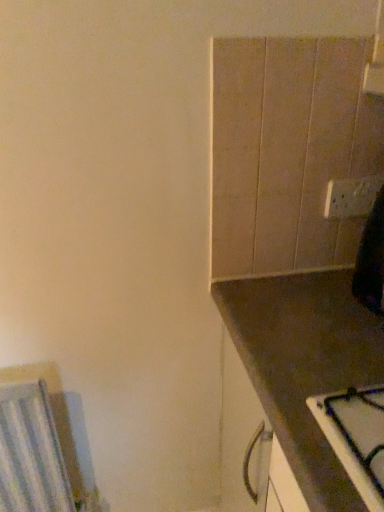
Question: Is white glossy electric outlet at upper right situated inside brown matte countertop at right or outside?

Choices:
 (A) inside
 (B) outside

Answer: (B)

Question: In terms of width, does white glossy electric outlet at upper right look wider or thinner when compared to brown matte countertop at right?

Choices:
 (A) wide
 (B) thin

Answer: (B)

Question: In the image, is white glossy electric outlet at upper right positioned in front of or behind brown matte countertop at right?

Choices:
 (A) front
 (B) behind

Answer: (B)

Question: From the image's perspective, is brown matte countertop at right above or below white glossy electric outlet at upper right?

Choices:
 (A) above
 (B) below

Answer: (B)

Question: Does point (248, 344) appear closer or farther from the camera than point (350, 215)?

Choices:
 (A) closer
 (B) farther

Answer: (A)

Question: Is brown matte countertop at right inside or outside of white glossy electric outlet at upper right?

Choices:
 (A) outside
 (B) inside

Answer: (A)

Question: From a real-world perspective, is brown matte countertop at right positioned above or below white glossy electric outlet at upper right?

Choices:
 (A) below
 (B) above

Answer: (A)